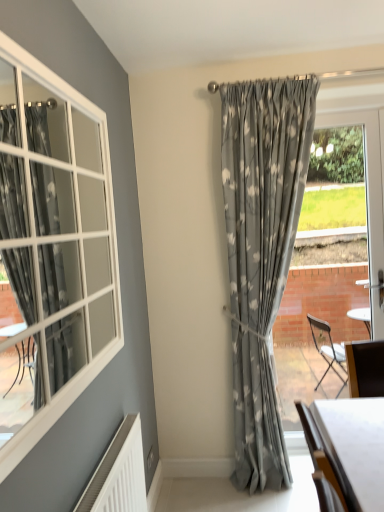
Question: Is point (304, 354) closer or farther from the camera than point (375, 486)?

Choices:
 (A) farther
 (B) closer

Answer: (A)

Question: Is clear glass door at right wider or thinner than white glossy table at lower right?

Choices:
 (A) wide
 (B) thin

Answer: (B)

Question: Which is farther from the clear glass door at right?

Choices:
 (A) white glossy table at lower right
 (B) matte gray curtain at center

Answer: (A)

Question: Which object is the farthest from the white glossy table at lower right?

Choices:
 (A) clear glass door at right
 (B) matte gray curtain at center

Answer: (A)